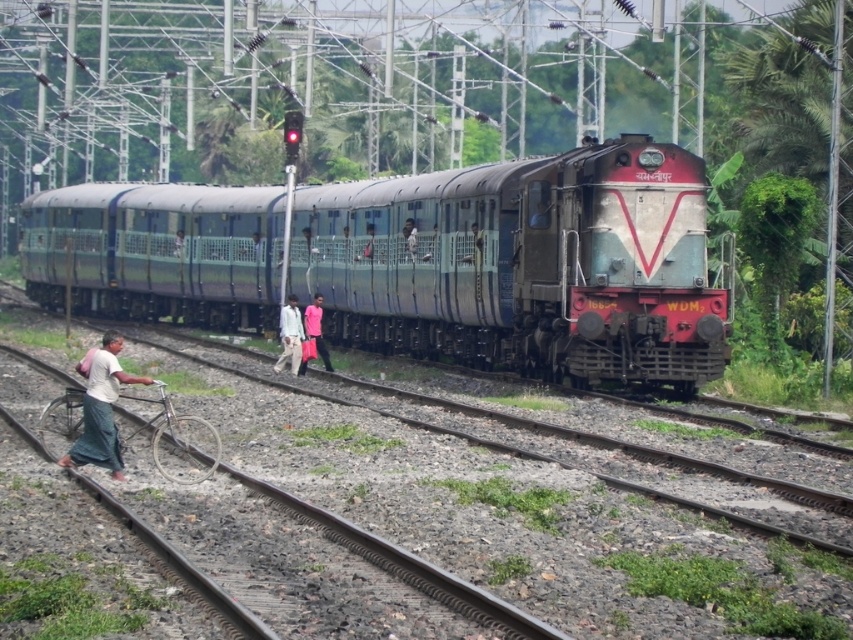
Question: Considering the relative positions of pink fabric bag at center and light blue fabric pants at center in the image provided, where is pink fabric bag at center located with respect to light blue fabric pants at center?

Choices:
 (A) right
 (B) left

Answer: (B)

Question: Can you confirm if white fabric shirt at lower left is positioned to the left of light blue fabric pants at center?

Choices:
 (A) yes
 (B) no

Answer: (A)

Question: Which of these objects is positioned farthest from the light blue fabric pants at center?

Choices:
 (A) white fabric shirt at lower left
 (B) pink fabric bag at center
 (C) light brown fabric pants at center

Answer: (A)

Question: In this image, where is green metallic train at center located relative to light blue fabric pants at center?

Choices:
 (A) left
 (B) right

Answer: (A)

Question: Which of the following is the farthest from the observer?

Choices:
 (A) white fabric shirt at lower left
 (B) light brown fabric pants at center

Answer: (B)

Question: Which is farther from the pink fabric bag at center?

Choices:
 (A) light brown fabric pants at center
 (B) green metallic train at center
 (C) light blue fabric pants at center

Answer: (B)